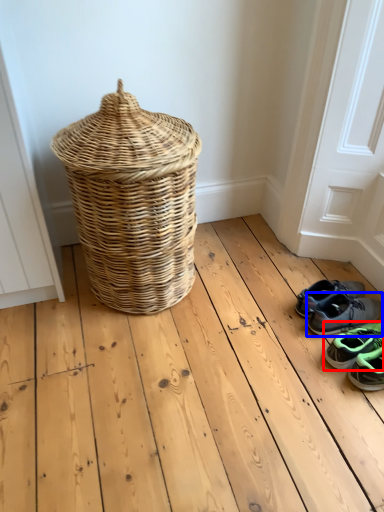
Question: Which object appears closest to the camera in this image, footwear (highlighted by a red box) or footwear (highlighted by a blue box)?

Choices:
 (A) footwear
 (B) footwear

Answer: (A)